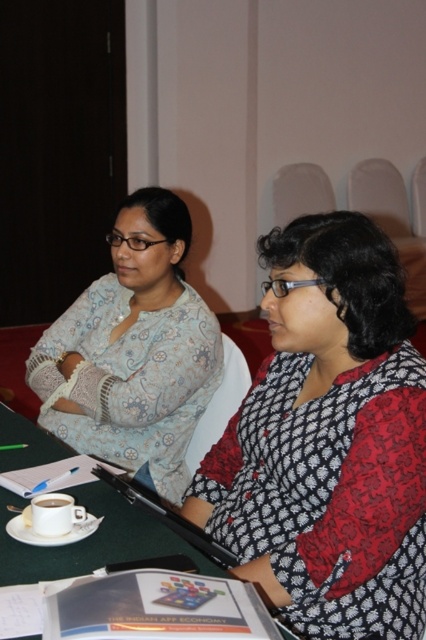
Question: Which point is closer to the camera taking this photo?

Choices:
 (A) (52, 500)
 (B) (310, 636)

Answer: (A)

Question: Is patterned fabric sweater at center above white ceramic cup at center?

Choices:
 (A) no
 (B) yes

Answer: (B)

Question: Observing the image, what is the correct spatial positioning of green fabric table at center in reference to matte white cup at lower left?

Choices:
 (A) left
 (B) right

Answer: (A)

Question: Among these points, which one is nearest to the camera?

Choices:
 (A) (91, 305)
 (B) (296, 422)
 (C) (52, 536)

Answer: (C)

Question: Does patterned fabric sweater at center have a larger size compared to white ceramic cup at center?

Choices:
 (A) yes
 (B) no

Answer: (A)

Question: Which of the following is the closest to the observer?

Choices:
 (A) (43, 499)
 (B) (26, 460)

Answer: (A)